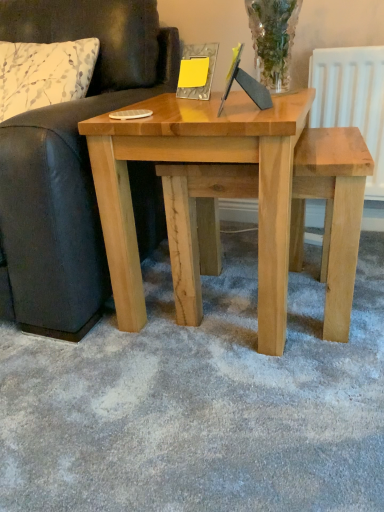
Question: Should I look upward or downward to see leather couch at left?

Choices:
 (A) down
 (B) up

Answer: (B)

Question: Is white floral fabric pillow at left bigger than natural wood table at center?

Choices:
 (A) yes
 (B) no

Answer: (B)

Question: Considering the relative sizes of white floral fabric pillow at left and natural wood table at center in the image provided, is white floral fabric pillow at left taller than natural wood table at center?

Choices:
 (A) yes
 (B) no

Answer: (B)

Question: Is white floral fabric pillow at left smaller than natural wood table at center?

Choices:
 (A) no
 (B) yes

Answer: (B)

Question: Does white floral fabric pillow at left lie in front of natural wood table at center?

Choices:
 (A) no
 (B) yes

Answer: (A)

Question: From a real-world perspective, is white floral fabric pillow at left under natural wood table at center?

Choices:
 (A) no
 (B) yes

Answer: (A)

Question: Does white floral fabric pillow at left turn towards natural wood table at center?

Choices:
 (A) yes
 (B) no

Answer: (B)

Question: Considering the relative positions of natural wood stool at center and leather couch at left in the image provided, is natural wood stool at center in front of leather couch at left?

Choices:
 (A) yes
 (B) no

Answer: (B)

Question: Is natural wood stool at center outside leather couch at left?

Choices:
 (A) yes
 (B) no

Answer: (A)

Question: Considering the relative sizes of natural wood stool at center and leather couch at left in the image provided, is natural wood stool at center bigger than leather couch at left?

Choices:
 (A) no
 (B) yes

Answer: (A)

Question: From a real-world perspective, is natural wood stool at center located beneath leather couch at left?

Choices:
 (A) no
 (B) yes

Answer: (B)

Question: Is leather couch at left located within natural wood stool at center?

Choices:
 (A) no
 (B) yes

Answer: (A)

Question: Considering the relative sizes of natural wood stool at center and leather couch at left in the image provided, is natural wood stool at center thinner than leather couch at left?

Choices:
 (A) yes
 (B) no

Answer: (A)

Question: Is white floral fabric pillow at left at the back of natural wood table at center?

Choices:
 (A) no
 (B) yes

Answer: (A)